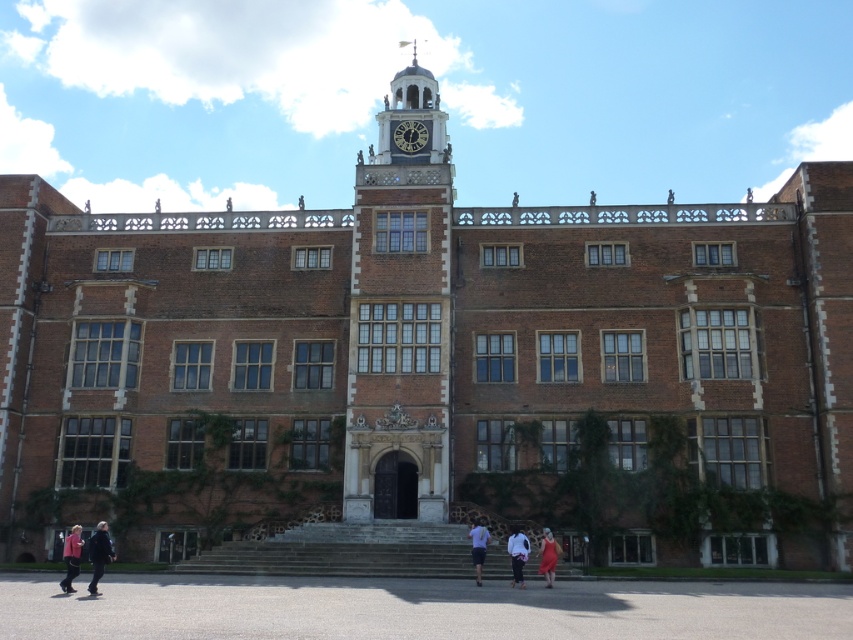
You are a fashion designer observing a photoshoot setup at this historic building. You notice the white cotton shirt at center and the matte red dress at lower center. Which garment appears shorter in the image?

The white cotton shirt at center appears shorter than the matte red dress at lower center.

You are standing in front of the historic building and see a white cotton shirt at center and a matte red dress at lower center. Which clothing item is placed higher up on the building?

The white cotton shirt at center is positioned over the matte red dress at lower center, so it is placed higher up on the building.

You are a photographer standing in front of the historic building. You notice the white cotton shirt at center and the matte red dress at lower center. Which clothing item is closer to you?

The white cotton shirt at center is closer to you because it is in front of the matte red dress at lower center.